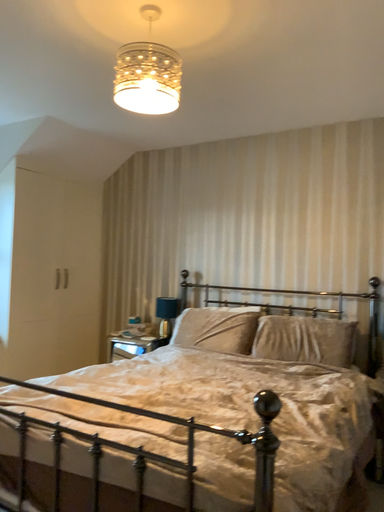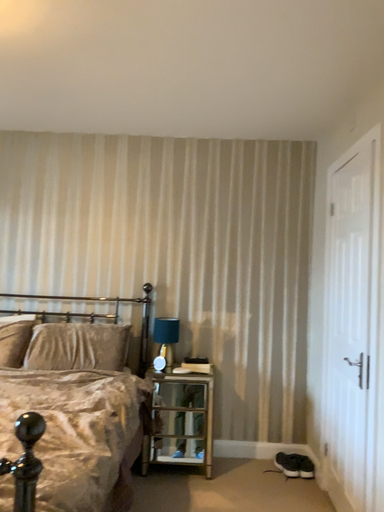
Question: How did the camera likely rotate when shooting the video?

Choices:
 (A) rotated left
 (B) rotated right

Answer: (B)